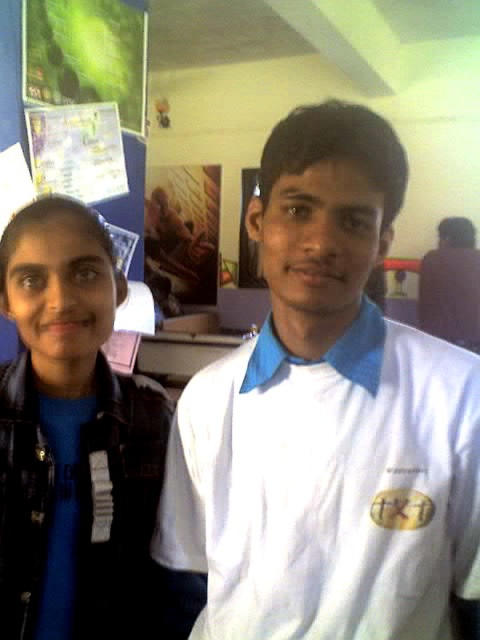
You are standing in the room and want to place a small plant between the two points, point (182,536) and point (62,593). Which point should the plant be closer to in order to be in front of the other point?

The plant should be closer to point (182,536) because it is in front of point (62,593).

You are an interior designer assessing the wall decorations in the scene. You need to determine which object is nearer to the camera between the green matte poster at upper left and the wooden carved figure at upper center. Which one is closer?

The green matte poster at upper left is closer to the viewer than the wooden carved figure at upper center.

You are standing in the room and want to touch the white cotton shirt at center. Based on its position coordinates, is it closer to the top or bottom of the image?

The white cotton shirt at center is located at point 0.681 on the vertical axis, which places it closer to the bottom of the image since values closer to 1 are lower down.